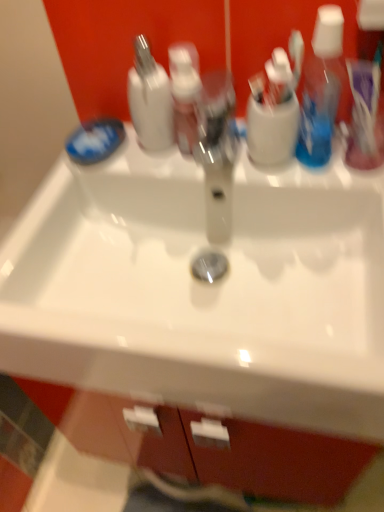
Question: Considering the relative sizes of white glossy bottle at upper center and translucent plastic toothbrush at upper right in the image provided, is white glossy bottle at upper center smaller than translucent plastic toothbrush at upper right?

Choices:
 (A) no
 (B) yes

Answer: (A)

Question: Considering the relative sizes of white glossy bottle at upper center and translucent plastic toothbrush at upper right in the image provided, is white glossy bottle at upper center taller than translucent plastic toothbrush at upper right?

Choices:
 (A) yes
 (B) no

Answer: (A)

Question: From the image's perspective, is white glossy bottle at upper center located beneath translucent plastic toothbrush at upper right?

Choices:
 (A) no
 (B) yes

Answer: (A)

Question: Is white glossy bottle at upper center at the right side of translucent plastic toothbrush at upper right?

Choices:
 (A) no
 (B) yes

Answer: (A)

Question: Is white glossy bottle at upper center positioned behind translucent plastic toothbrush at upper right?

Choices:
 (A) no
 (B) yes

Answer: (B)

Question: Is white glossy bottle at upper center closer to the viewer compared to translucent plastic toothbrush at upper right?

Choices:
 (A) no
 (B) yes

Answer: (A)

Question: Would you say translucent plastic toothbrush at upper right is a long distance from blue matte soap at left?

Choices:
 (A) no
 (B) yes

Answer: (A)

Question: From the image's perspective, does translucent plastic toothbrush at upper right appear higher than blue matte soap at left?

Choices:
 (A) yes
 (B) no

Answer: (A)

Question: Can you confirm if translucent plastic toothbrush at upper right is shorter than blue matte soap at left?

Choices:
 (A) no
 (B) yes

Answer: (A)

Question: Is translucent plastic toothbrush at upper right wider than blue matte soap at left?

Choices:
 (A) no
 (B) yes

Answer: (A)

Question: Could you tell me if translucent plastic toothbrush at upper right is facing blue matte soap at left?

Choices:
 (A) yes
 (B) no

Answer: (B)

Question: Is translucent plastic toothbrush at upper right not inside blue matte soap at left?

Choices:
 (A) no
 (B) yes

Answer: (B)

Question: Is blue matte soap at left at the left side of translucent pink pump bottle at center?

Choices:
 (A) no
 (B) yes

Answer: (B)